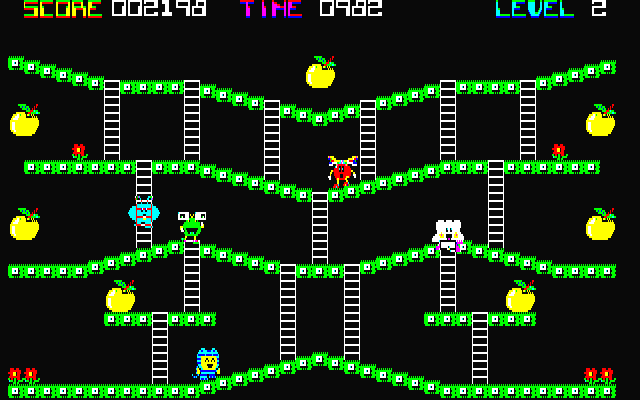
This screenshot has height=400, width=640. What are the coordinates of `white ladder to the left of figure wearing blue suit` in the screenshot? It's located at (162, 314), (157, 335), (160, 373).